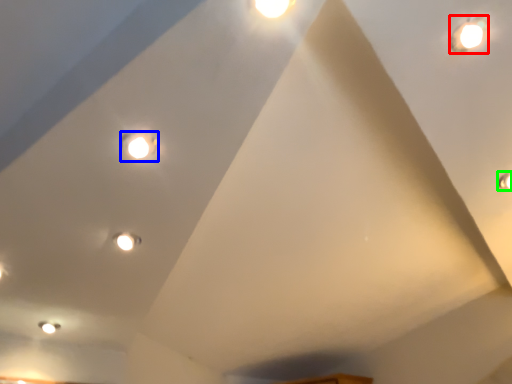
Question: Which object is positioned closest to droplight (highlighted by a red box)? Select from light (highlighted by a blue box) and light (highlighted by a green box).

Choices:
 (A) light
 (B) light

Answer: (B)